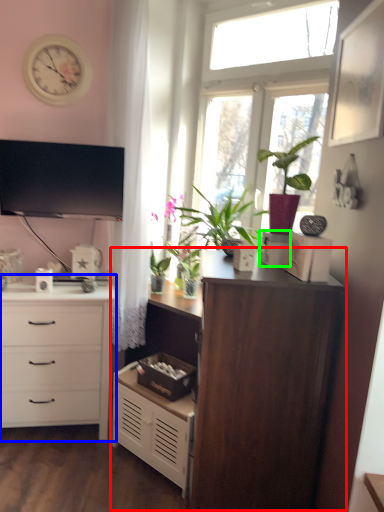
Question: Estimate the real-world distances between objects in this image. Which object is farther from cupboard (highlighted by a red box), chest of drawers (highlighted by a blue box) or storage box (highlighted by a green box)?

Choices:
 (A) chest of drawers
 (B) storage box

Answer: (A)